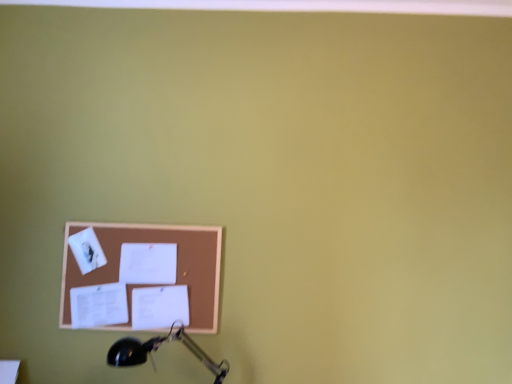
Question: Can you confirm if brown corkboard at lower left is shorter than black metal table lamp at lower left?

Choices:
 (A) no
 (B) yes

Answer: (A)

Question: From a real-world perspective, is brown corkboard at lower left positioned under black metal table lamp at lower left based on gravity?

Choices:
 (A) no
 (B) yes

Answer: (A)

Question: From the image's perspective, is brown corkboard at lower left under black metal table lamp at lower left?

Choices:
 (A) no
 (B) yes

Answer: (A)

Question: Is brown corkboard at lower left positioned in front of black metal table lamp at lower left?

Choices:
 (A) no
 (B) yes

Answer: (A)

Question: Could you tell me if brown corkboard at lower left is turned towards black metal table lamp at lower left?

Choices:
 (A) yes
 (B) no

Answer: (A)

Question: Is black metal table lamp at lower left surrounded by brown corkboard at lower left?

Choices:
 (A) yes
 (B) no

Answer: (B)

Question: Considering the relative positions of black metal table lamp at lower left and brown corkboard at lower left in the image provided, is black metal table lamp at lower left to the right of brown corkboard at lower left from the viewer's perspective?

Choices:
 (A) no
 (B) yes

Answer: (B)

Question: Could you tell me if black metal table lamp at lower left is facing brown corkboard at lower left?

Choices:
 (A) yes
 (B) no

Answer: (B)

Question: Is black metal table lamp at lower left far away from brown corkboard at lower left?

Choices:
 (A) yes
 (B) no

Answer: (B)

Question: From a real-world perspective, is black metal table lamp at lower left positioned under brown corkboard at lower left based on gravity?

Choices:
 (A) yes
 (B) no

Answer: (A)

Question: Can brown corkboard at lower left be found inside black metal table lamp at lower left?

Choices:
 (A) no
 (B) yes

Answer: (A)

Question: Does black metal table lamp at lower left have a lesser height compared to brown corkboard at lower left?

Choices:
 (A) yes
 (B) no

Answer: (A)

Question: Is black metal table lamp at lower left wider or thinner than brown corkboard at lower left?

Choices:
 (A) wide
 (B) thin

Answer: (A)